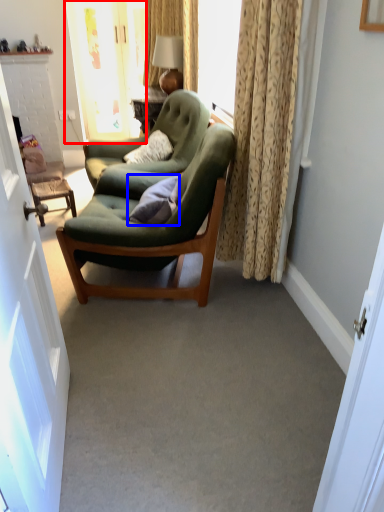
Question: Which of the following is the farthest to the observer, glass door (highlighted by a red box) or pillow (highlighted by a blue box)?

Choices:
 (A) glass door
 (B) pillow

Answer: (A)